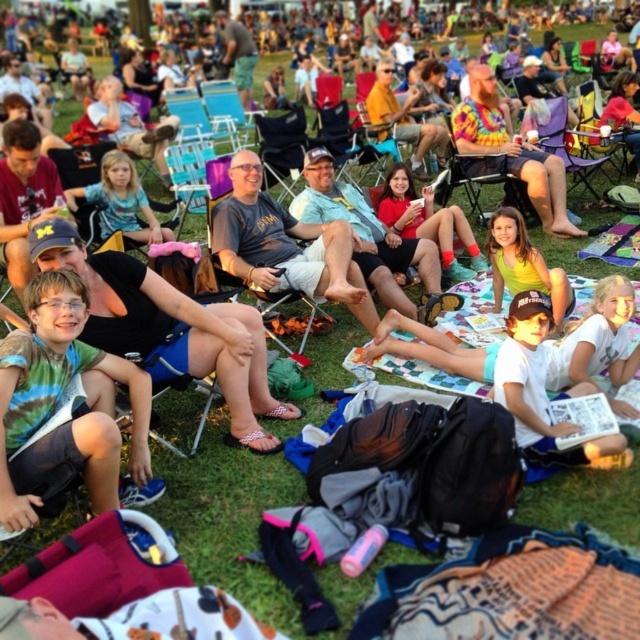
Question: Can you confirm if matte black shorts at center is thinner than tie-dye fabric shirt at center?

Choices:
 (A) yes
 (B) no

Answer: (A)

Question: Is white cotton shirt at lower right smaller than tie-dye fabric chair at center?

Choices:
 (A) no
 (B) yes

Answer: (B)

Question: Which object is farther from the camera taking this photo?

Choices:
 (A) green tie-dye shirt at left
 (B) tie-dye fabric shirt at center

Answer: (B)

Question: Does tie-dye shirt at center have a smaller size compared to metallic silver folding chair at center?

Choices:
 (A) yes
 (B) no

Answer: (B)

Question: Which point appears farthest from the camera in this image?

Choices:
 (A) (284, 220)
 (B) (461, 166)

Answer: (B)

Question: Which object is positioned closest to the white cotton shirt at lower right?

Choices:
 (A) tie-dye fabric shirt at center
 (B) matte black shorts at center

Answer: (B)